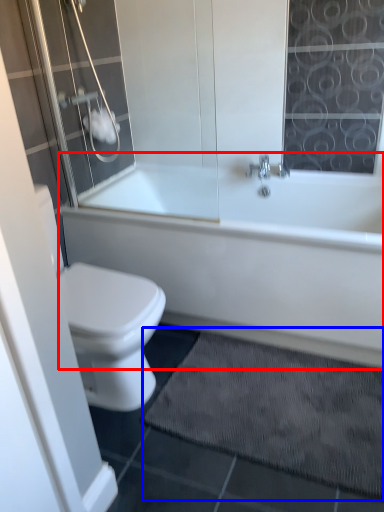
Question: Which point is further to the camera, bathtub (highlighted by a red box) or bath mat (highlighted by a blue box)?

Choices:
 (A) bathtub
 (B) bath mat

Answer: (A)